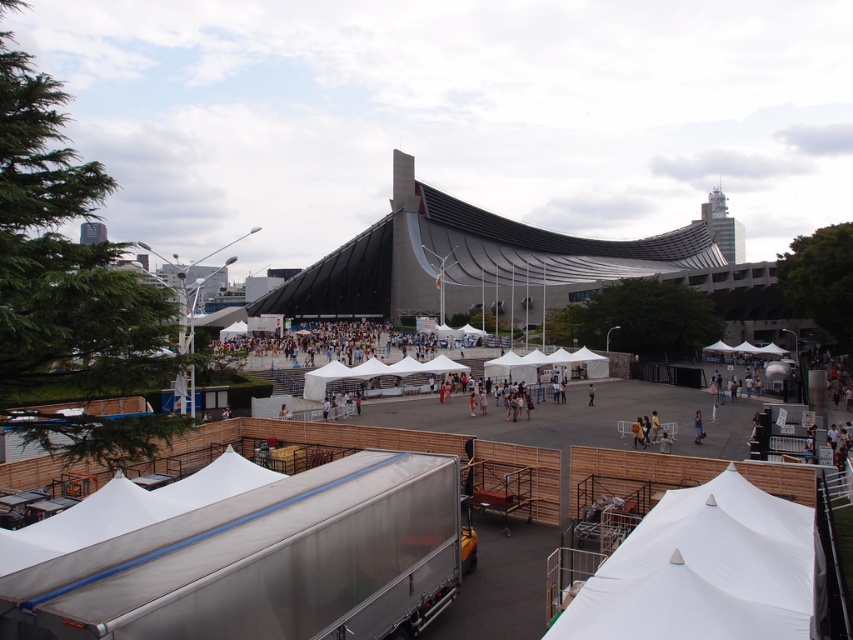
Question: Observing the image, what is the correct spatial positioning of white fabric tent at lower right in reference to orange fabric bag at center?

Choices:
 (A) below
 (B) above

Answer: (A)

Question: Which point is farther to the camera?

Choices:
 (A) tap(360, 326)
 (B) tap(695, 422)
 (C) tap(625, 566)

Answer: (A)

Question: Is white fabric tent at center positioned in front of light blue fabric shirt at center?

Choices:
 (A) no
 (B) yes

Answer: (A)

Question: Where is white fabric tent at lower right located in relation to white fabric tent at center in the image?

Choices:
 (A) left
 (B) right

Answer: (B)

Question: Which point is closer to the camera taking this photo?

Choices:
 (A) (641, 429)
 (B) (694, 420)
 (C) (788, 602)
 (D) (263, 362)

Answer: (C)

Question: Considering the real-world distances, which object is farthest from the white fabric tent at lower right?

Choices:
 (A) light blue fabric shirt at center
 (B) white fabric tent at center

Answer: (B)